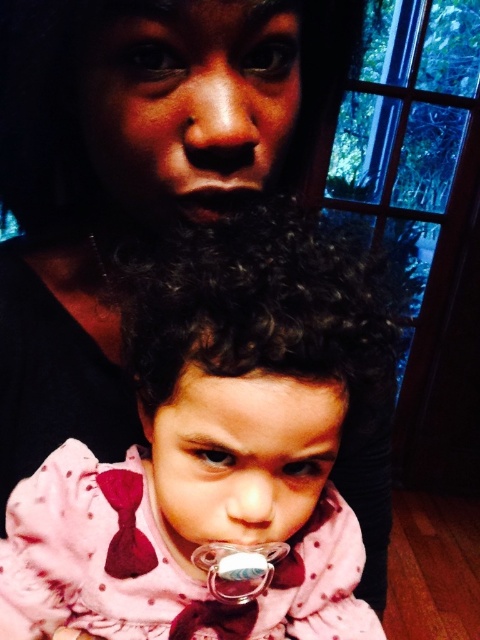
Image resolution: width=480 pixels, height=640 pixels. What do you see at coordinates (211, 449) in the screenshot? I see `pink fabric pacifier at center` at bounding box center [211, 449].

Does pink fabric pacifier at center have a greater height compared to dry matte lips at center?

Yes.

Is point (310, 246) farther from viewer compared to point (178, 200)?

No, it is not.

Image resolution: width=480 pixels, height=640 pixels. Find the location of `pink fabric pacifier at center`. pink fabric pacifier at center is located at coordinates (211, 449).

Can you confirm if pink fabric pacifier at center is taller than clear plastic pacifier at center?

Yes, pink fabric pacifier at center is taller than clear plastic pacifier at center.

In the scene shown: Can you confirm if pink fabric pacifier at center is wider than clear plastic pacifier at center?

Correct, the width of pink fabric pacifier at center exceeds that of clear plastic pacifier at center.

Does point (229, 221) lie in front of point (239, 580)?

That is True.

Find the location of a particular element. Image resolution: width=480 pixels, height=640 pixels. pink fabric pacifier at center is located at coordinates (211, 449).

Is clear plastic pacifier at center below dry matte lips at center?

Indeed, clear plastic pacifier at center is positioned under dry matte lips at center.

Does clear plastic pacifier at center appear on the right side of dry matte lips at center?

Yes, clear plastic pacifier at center is to the right of dry matte lips at center.

Image resolution: width=480 pixels, height=640 pixels. What are the coordinates of `clear plastic pacifier at center` in the screenshot? It's located at (239, 568).

This screenshot has height=640, width=480. I want to click on clear plastic pacifier at center, so click(x=239, y=568).